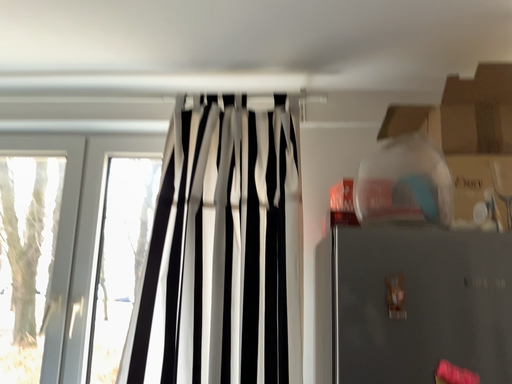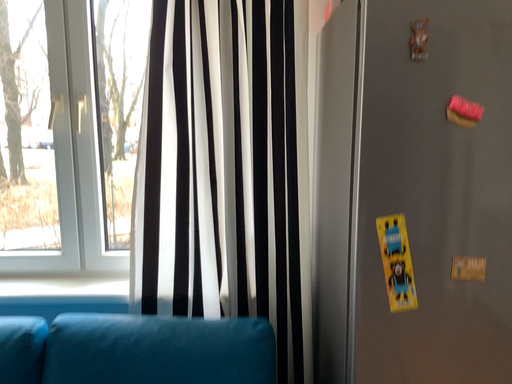
Question: How did the camera likely rotate when shooting the video?

Choices:
 (A) rotated upward
 (B) rotated downward

Answer: (B)